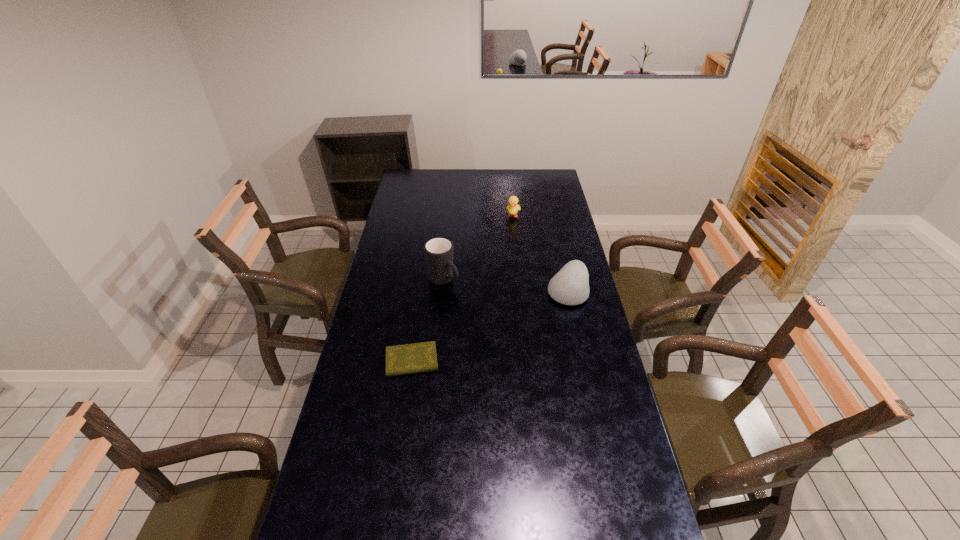
Where is `vacant space on the desktop that is between the nearest object and the rightmost object and is positioned on the front-facing side of the third object from left to right`? Image resolution: width=960 pixels, height=540 pixels. vacant space on the desktop that is between the nearest object and the rightmost object and is positioned on the front-facing side of the third object from left to right is located at coordinates (492, 325).

You are a GUI agent. You are given a task and a screenshot of the screen. Output one action in this format:
    pyautogui.click(x=<x>, y=<y>)
    Task: Click on the free space on the desktop that is between the diary and the beanie and is positioned on the side of the mug with the handle
    The image size is (960, 540).
    Given the screenshot: What is the action you would take?
    pyautogui.click(x=497, y=323)